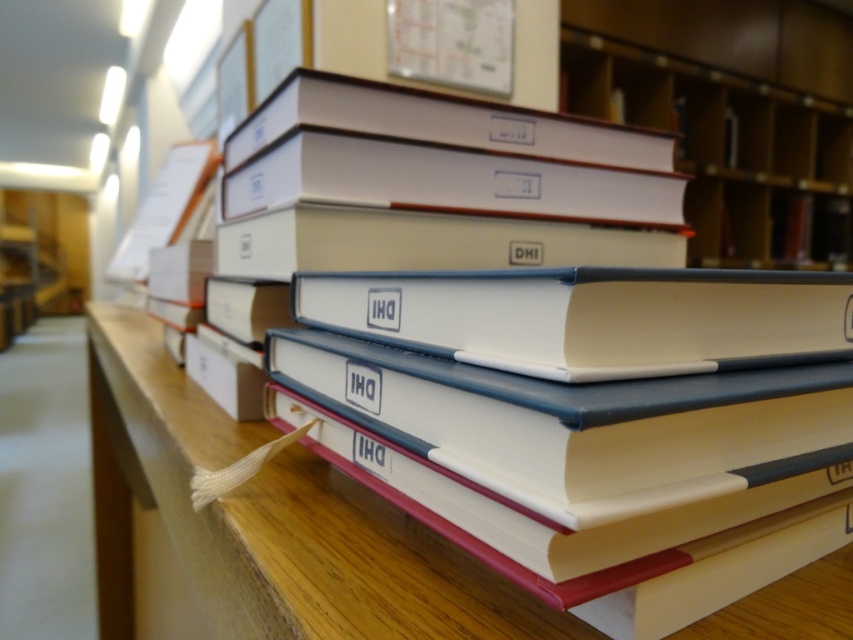
Who is lower down, white matte book at center or matte white book at upper center?

white matte book at center is below.

Does white matte book at center have a greater height compared to matte white book at upper center?

No.

Describe the element at coordinates (590, 317) in the screenshot. I see `white matte book at center` at that location.

The height and width of the screenshot is (640, 853). I want to click on white matte book at center, so click(590, 317).

Is point (383, 560) closer to viewer compared to point (778, 355)?

No, it is behind (778, 355).

The image size is (853, 640). I want to click on wooden table at center, so pos(259,525).

Is wooden table at center shorter than matte white book at upper center?

Correct, wooden table at center is not as tall as matte white book at upper center.

Between point (183, 618) and point (694, 180), which one is positioned behind?

Positioned behind is point (694, 180).

I want to click on wooden table at center, so click(x=259, y=525).